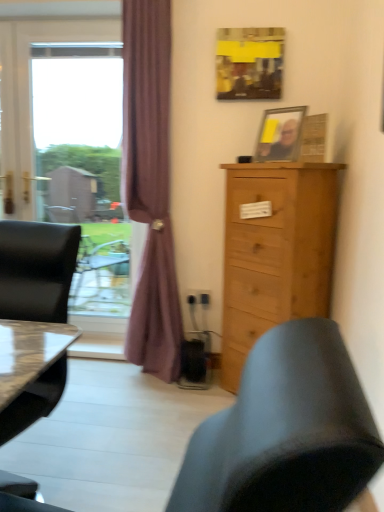
Question: Is there a large distance between purple fabric curtain at left and wooden picture frame at upper right, which ranks as the second picture frame in top-to-bottom order?

Choices:
 (A) yes
 (B) no

Answer: (B)

Question: From the image's perspective, does purple fabric curtain at left appear higher than wooden picture frame at upper right, which ranks as the second picture frame in top-to-bottom order?

Choices:
 (A) no
 (B) yes

Answer: (A)

Question: Can you confirm if purple fabric curtain at left is shorter than wooden picture frame at upper right, arranged as the 1th picture frame when ordered from the bottom?

Choices:
 (A) no
 (B) yes

Answer: (A)

Question: Is wooden picture frame at upper right, which ranks as the second picture frame in top-to-bottom order, surrounded by purple fabric curtain at left?

Choices:
 (A) no
 (B) yes

Answer: (A)

Question: Does purple fabric curtain at left lie behind wooden picture frame at upper right, which ranks as the second picture frame in top-to-bottom order?

Choices:
 (A) yes
 (B) no

Answer: (A)

Question: Can you confirm if purple fabric curtain at left is bigger than wooden picture frame at upper right, which ranks as the second picture frame in top-to-bottom order?

Choices:
 (A) yes
 (B) no

Answer: (A)

Question: Is natural wood cabinet at right bigger than purple fabric curtain at left?

Choices:
 (A) yes
 (B) no

Answer: (A)

Question: Can you confirm if natural wood cabinet at right is wider than purple fabric curtain at left?

Choices:
 (A) yes
 (B) no

Answer: (A)

Question: Are natural wood cabinet at right and purple fabric curtain at left far apart?

Choices:
 (A) yes
 (B) no

Answer: (B)

Question: Is natural wood cabinet at right further to the viewer compared to purple fabric curtain at left?

Choices:
 (A) no
 (B) yes

Answer: (A)

Question: Would you say purple fabric curtain at left is part of natural wood cabinet at right's contents?

Choices:
 (A) yes
 (B) no

Answer: (B)

Question: Is natural wood cabinet at right next to purple fabric curtain at left?

Choices:
 (A) no
 (B) yes

Answer: (A)

Question: Can you confirm if purple fabric curtain at left is shorter than transparent glass window at left?

Choices:
 (A) yes
 (B) no

Answer: (B)